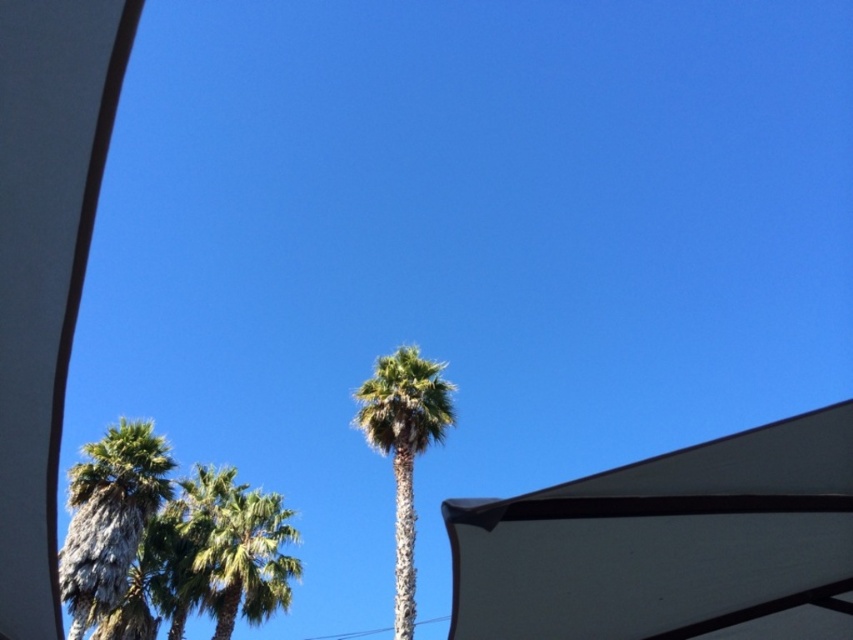
Question: Is the position of white matte umbrella at lower right less distant than that of green textured palm tree at center?

Choices:
 (A) no
 (B) yes

Answer: (B)

Question: Which point is closer to the camera?

Choices:
 (A) (204, 554)
 (B) (445, 380)

Answer: (B)

Question: Can you confirm if white matte umbrella at lower right is bigger than white matte canopy at left?

Choices:
 (A) yes
 (B) no

Answer: (B)

Question: Does white matte umbrella at lower right appear on the left side of white matte canopy at left?

Choices:
 (A) no
 (B) yes

Answer: (A)

Question: Which point is closer to the camera?

Choices:
 (A) (239, 490)
 (B) (430, 376)

Answer: (B)

Question: Which of these objects is positioned closest to the green leafy palm tree at left?

Choices:
 (A) green leafy palm tree at center
 (B) white matte umbrella at lower right
 (C) white matte canopy at left

Answer: (A)